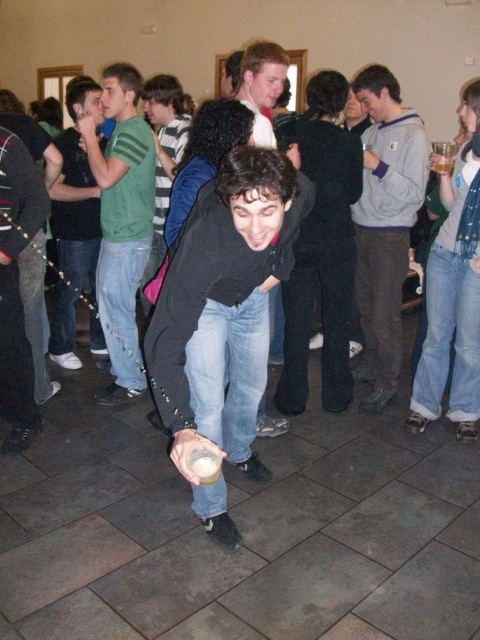
Does black matte jacket at center appear under gray fleece sweater at center?

Result: Correct, black matte jacket at center is located below gray fleece sweater at center.

Who is more forward, (192,365) or (379,166)?

Positioned in front is point (192,365).

What do you see at coordinates (224, 316) in the screenshot? I see `black matte jacket at center` at bounding box center [224, 316].

The width and height of the screenshot is (480, 640). Find the location of `black matte jacket at center`. black matte jacket at center is located at coordinates (224, 316).

Is black matte jacket at center to the left of green striped shirt at upper left from the viewer's perspective?

Incorrect, black matte jacket at center is not on the left side of green striped shirt at upper left.

Can you confirm if black matte jacket at center is positioned to the right of green striped shirt at upper left?

Correct, you'll find black matte jacket at center to the right of green striped shirt at upper left.

Is point (230, 438) less distant than point (122, 323)?

Yes, it is.

The height and width of the screenshot is (640, 480). In order to click on black matte jacket at center in this screenshot , I will do coord(224,316).

Who is positioned more to the left, gray fleece sweater at center or matte black shirt at upper left?

Positioned to the left is matte black shirt at upper left.

Looking at this image, is the position of gray fleece sweater at center less distant than that of matte black shirt at upper left?

Yes, it is.

Which is behind, point (403, 221) or point (60, 150)?

Positioned behind is point (60, 150).

The height and width of the screenshot is (640, 480). In order to click on gray fleece sweater at center in this screenshot , I will do `click(384, 225)`.